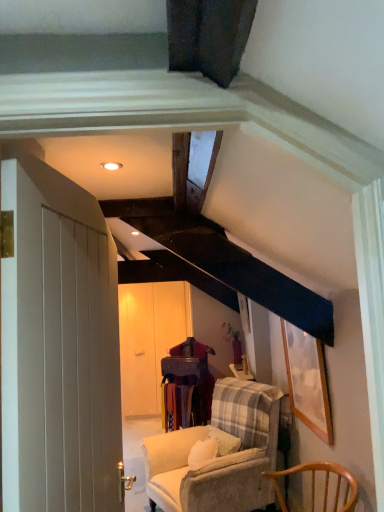
Question: From a real-world perspective, is velvet beige armchair at center, the second chair viewed from the front, above or below wooden picture frame at upper right?

Choices:
 (A) below
 (B) above

Answer: (A)

Question: In terms of height, does velvet beige armchair at center, the second chair viewed from the front, look taller or shorter compared to wooden picture frame at upper right?

Choices:
 (A) tall
 (B) short

Answer: (A)

Question: Which is nearer to the wooden picture frame at upper right?

Choices:
 (A) wooden chair at lower right, positioned as the first chair in front-to-back order
 (B) wooden table at center
 (C) white wooden door at left
 (D) velvet beige armchair at center, which is counted as the first chair, starting from the back
 (E) matte white wardrobe at center

Answer: (A)

Question: Which object is the closest to the white wooden door at left?

Choices:
 (A) velvet beige armchair at center, which is counted as the first chair, starting from the back
 (B) matte white wardrobe at center
 (C) wooden chair at lower right, which is the second chair from back to front
 (D) wooden table at center
 (E) wooden picture frame at upper right

Answer: (C)